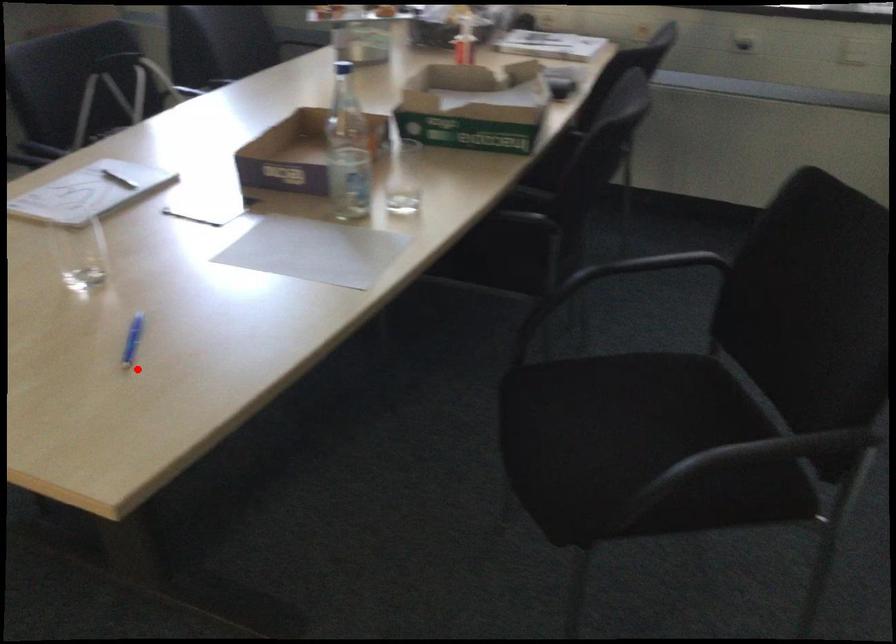
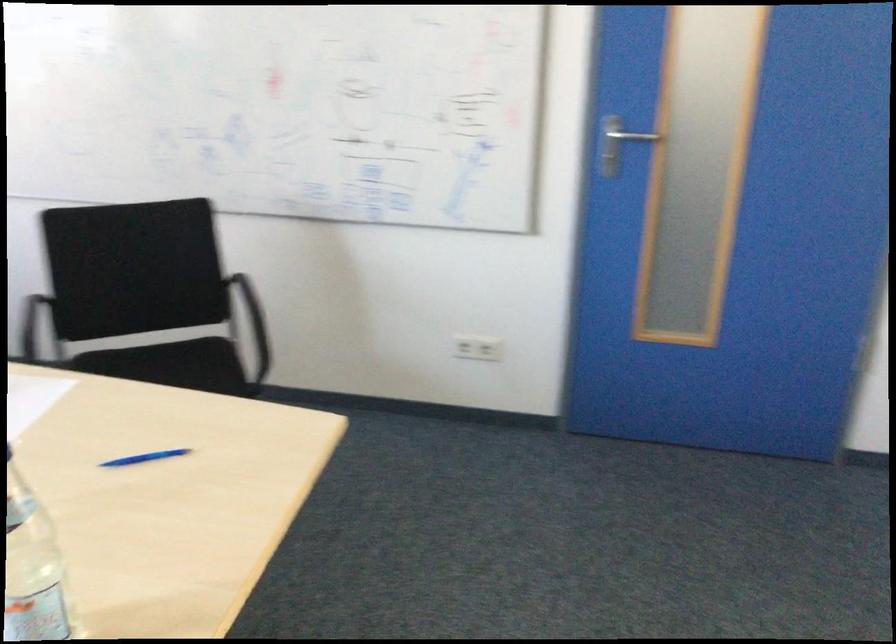
Find the pixel in the second image that matches the highlighted location in the first image.

(143, 458)